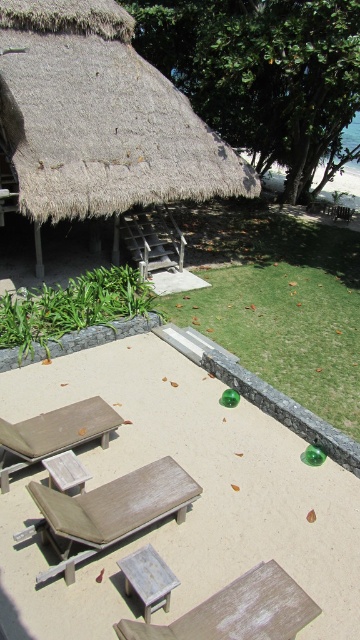
You are a guest at the resort and want to place a 2.0 meter long umbrella between the matte brown lounge chair at center and the white painted wood picnic table at center. Can you fit it there?

The distance between the matte brown lounge chair at center and the white painted wood picnic table at center is 1.94 meters, which is shorter than the 2.0 meter umbrella. Therefore, the umbrella cannot be placed between them as it would not fit.

You are a guest at the resort and want to place a large umbrella on the white painted wood picnic table at center. However, you notice the matte brown lounge chair at center is in the way. Can you move the lounge chair forward so the picnic table becomes accessible?

The white painted wood picnic table at center is behind the matte brown lounge chair at center. Moving the lounge chair forward would bring it closer to the picnic table, but since the picnic table is already behind the lounge chair, moving it forward might not make the picnic table more accessible. You might need to move the lounge chair backward instead.